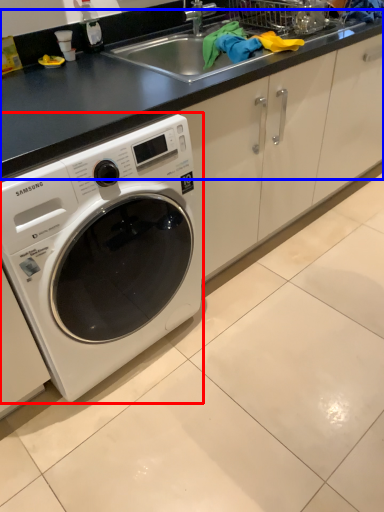
Question: Which point is closer to the camera, washing machine (highlighted by a red box) or counter top (highlighted by a blue box)?

Choices:
 (A) washing machine
 (B) counter top

Answer: (A)